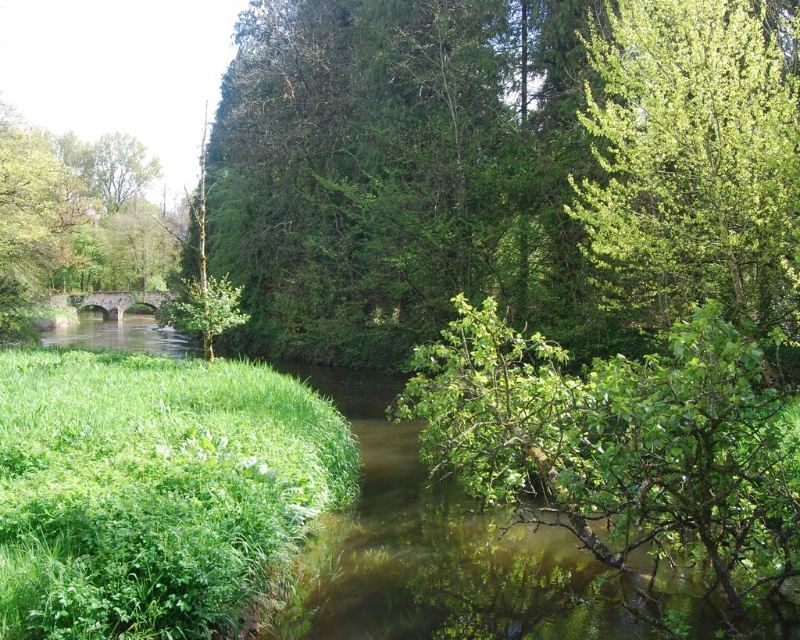
Question: Which point is farther from the camera taking this photo?

Choices:
 (A) (390, 129)
 (B) (616, 164)

Answer: (A)

Question: Which point appears farthest from the camera in this image?

Choices:
 (A) (709, 179)
 (B) (246, 32)

Answer: (B)

Question: Considering the relative positions of green leafy tree at upper center and green leafy tree at upper right in the image provided, where is green leafy tree at upper center located with respect to green leafy tree at upper right?

Choices:
 (A) left
 (B) right

Answer: (A)

Question: Is green leafy tree at upper center above green leafy tree at upper right?

Choices:
 (A) no
 (B) yes

Answer: (B)

Question: Which point appears closest to the camera in this image?

Choices:
 (A) (297, 74)
 (B) (692, 180)

Answer: (B)

Question: Considering the relative positions of green leafy tree at upper center and green leafy tree at upper right in the image provided, where is green leafy tree at upper center located with respect to green leafy tree at upper right?

Choices:
 (A) below
 (B) above

Answer: (B)